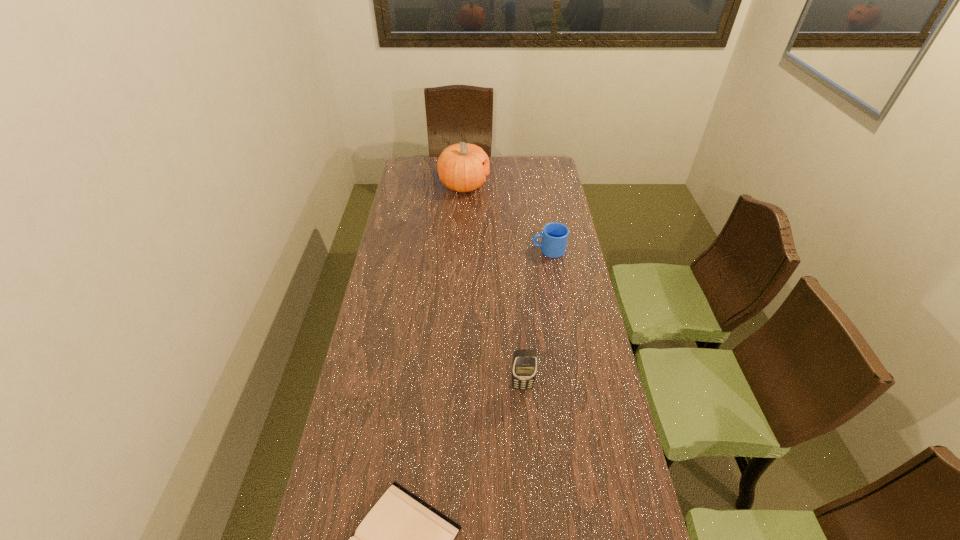
Where is `the tallest object`? the tallest object is located at coordinates (x=463, y=167).

In order to click on pumpkin in this screenshot , I will do `click(463, 167)`.

Where is `the third farthest object`? the third farthest object is located at coordinates (525, 362).

I want to click on the second object from right to left, so 525,362.

Image resolution: width=960 pixels, height=540 pixels. Find the location of `mug`. mug is located at coordinates (555, 235).

Identify the location of the third nearest object. (555, 235).

Identify the location of vacant region located 0.090m on the front-facing side of the tallest object. The width and height of the screenshot is (960, 540). (508, 185).

The width and height of the screenshot is (960, 540). Identify the location of free region located 0.270m on the front face of the third object from left to right. (530, 482).

This screenshot has width=960, height=540. Identify the location of free space located 0.120m on the side of the mug with the handle. (502, 250).

Identify the location of vacant space located 0.280m on the side of the mug with the handle. (464, 250).